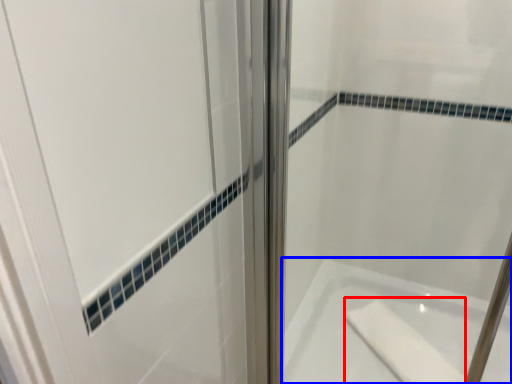
Question: Which of the following is the farthest to the observer, soap (highlighted by a red box) or bathtub (highlighted by a blue box)?

Choices:
 (A) soap
 (B) bathtub

Answer: (A)